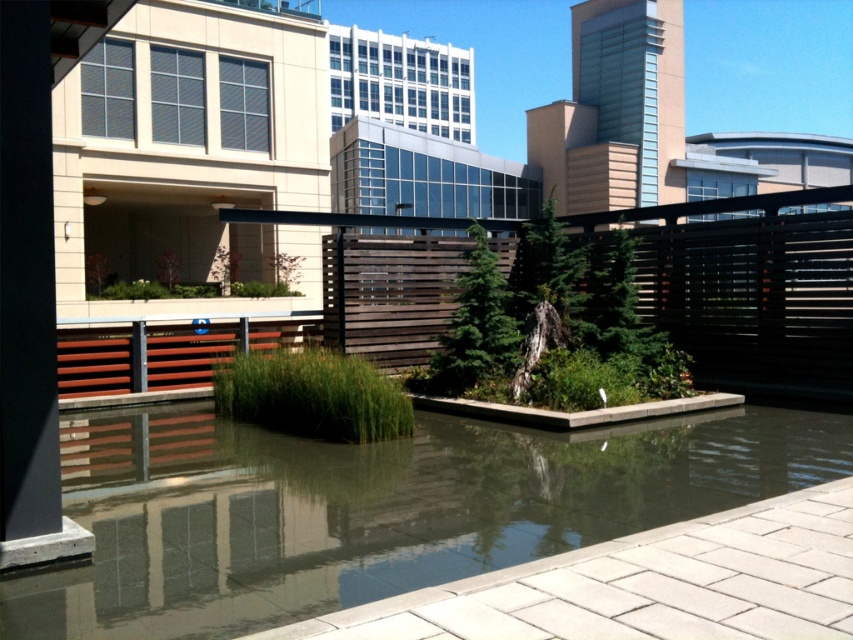
This screenshot has width=853, height=640. Describe the element at coordinates (372, 508) in the screenshot. I see `clear glass water at center` at that location.

Can you confirm if clear glass water at center is positioned below dark brown wooden fence at center?

Yes.

Who is more distant from viewer, (189, 625) or (809, 394)?

The point (809, 394) is more distant.

Find the location of a particular element. This screenshot has height=640, width=853. clear glass water at center is located at coordinates (372, 508).